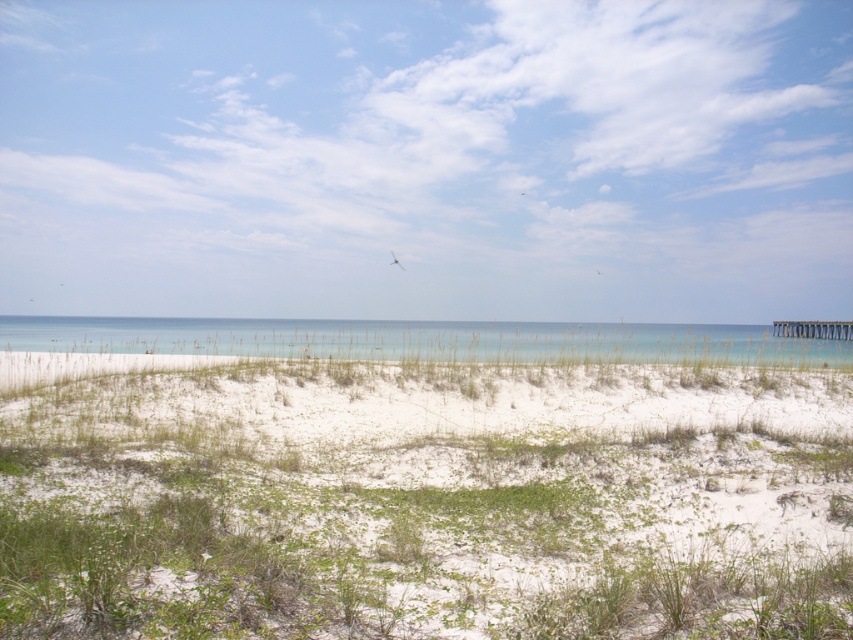
Question: Among these points, which one is farthest from the camera?

Choices:
 (A) (35, 349)
 (B) (791, 540)

Answer: (A)

Question: Which object is closer to the camera taking this photo?

Choices:
 (A) clear blue water at center
 (B) white sand dunes at center

Answer: (B)

Question: Is white sand dunes at center to the right of clear blue water at center from the viewer's perspective?

Choices:
 (A) no
 (B) yes

Answer: (B)

Question: Is white sand dunes at center to the right of clear blue water at center from the viewer's perspective?

Choices:
 (A) yes
 (B) no

Answer: (A)

Question: Is white sand dunes at center to the left of clear blue water at center from the viewer's perspective?

Choices:
 (A) no
 (B) yes

Answer: (A)